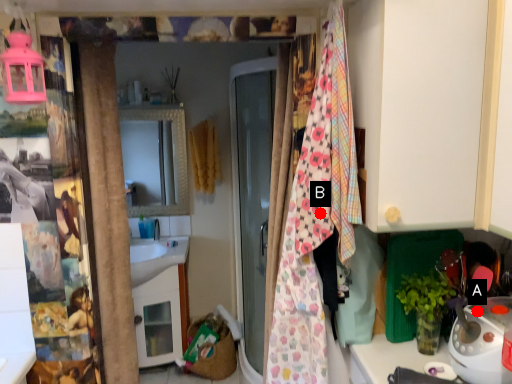
Question: Two points are circled on the image, labeled by A and B beside each circle. Which of the following is the closest to the observer?

Choices:
 (A) A is closer
 (B) B is closer

Answer: (A)